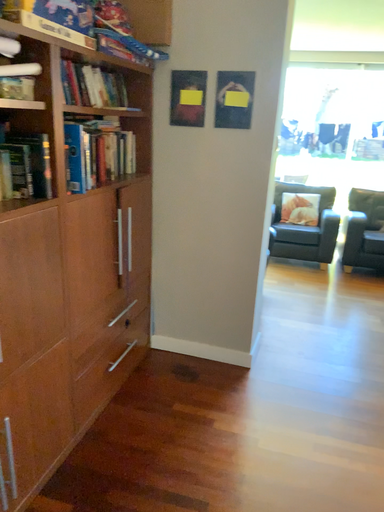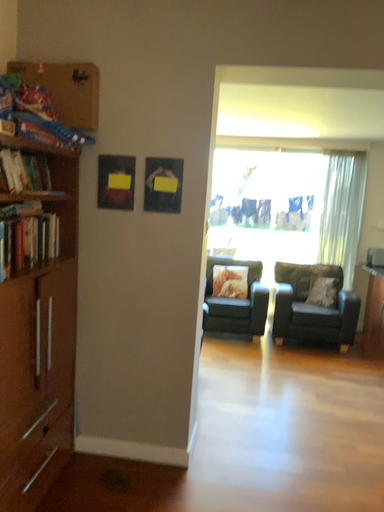
Question: How did the camera likely rotate when shooting the video?

Choices:
 (A) rotated upward
 (B) rotated downward

Answer: (A)